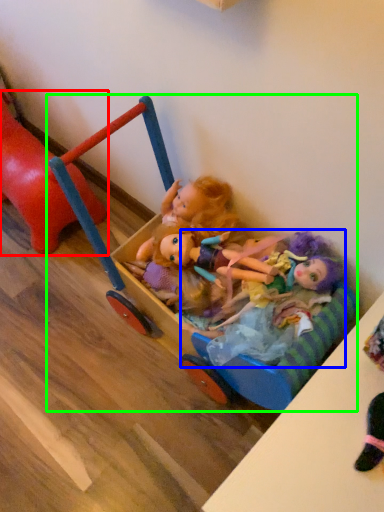
Question: Which is nearer to the toy (highlighted by a red box)? doll (highlighted by a blue box) or toy (highlighted by a green box).

Choices:
 (A) doll
 (B) toy

Answer: (B)